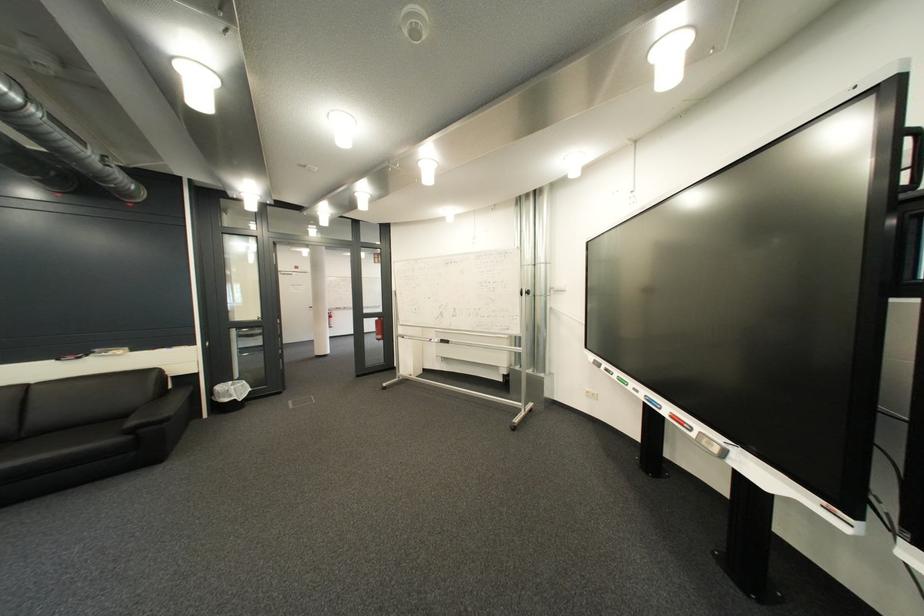
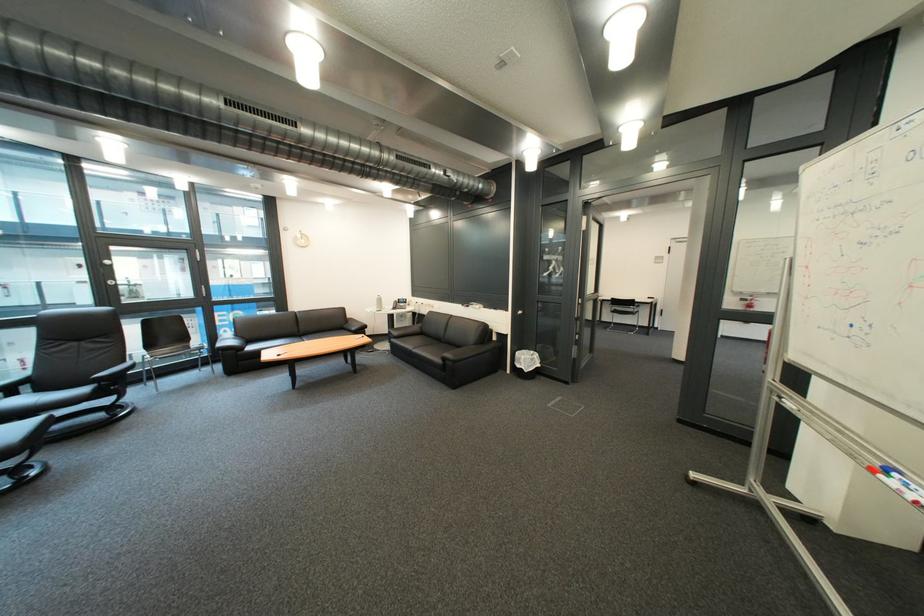
The point at (246, 392) is marked in the first image. Where is the corresponding point in the second image?

(536, 363)